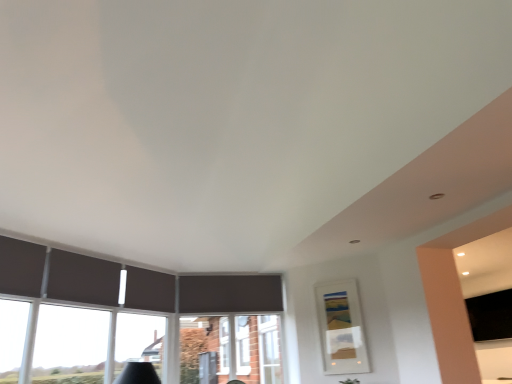
Locate an element on the screen. This screenshot has width=512, height=384. matte white picture frame at center-right is located at coordinates (341, 328).

This screenshot has width=512, height=384. What do you see at coordinates (269, 349) in the screenshot?
I see `white plastic window frame at center` at bounding box center [269, 349].

Where is `matte white picture frame at center-right`? The height and width of the screenshot is (384, 512). matte white picture frame at center-right is located at coordinates (341, 328).

From a real-world perspective, is white plastic window frame at center physically above transparent glass window at lower left?

No, from a real-world perspective, white plastic window frame at center is not above transparent glass window at lower left.

Is white plastic window frame at center wider or thinner than transparent glass window at lower left?

Considering their sizes, white plastic window frame at center looks broader than transparent glass window at lower left.

Looking at this image, considering the positions of objects white plastic window frame at center and transparent glass window at lower left in the image provided, who is more to the right, white plastic window frame at center or transparent glass window at lower left?

From the viewer's perspective, white plastic window frame at center appears more on the right side.

Does white plastic window frame at center have a smaller size compared to transparent glass window at lower left?

Actually, white plastic window frame at center might be larger than transparent glass window at lower left.

Is black matte tv at right located outside matte white picture frame at center-right?

Indeed, black matte tv at right is completely outside matte white picture frame at center-right.

Does black matte tv at right turn towards matte white picture frame at center-right?

Yes, black matte tv at right is oriented towards matte white picture frame at center-right.

Between black matte tv at right and matte white picture frame at center-right, which one appears on the right side from the viewer's perspective?

black matte tv at right.

Which is more distant, (x=480, y=325) or (x=154, y=332)?

The point (x=154, y=332) is more distant.

Does black matte tv at right contain transparent glass window at lower left?

Actually, transparent glass window at lower left is outside black matte tv at right.

From a real-world perspective, between black matte tv at right and transparent glass window at lower left, who is vertically lower?

transparent glass window at lower left.

Does black matte tv at right have a greater width compared to transparent glass window at lower left?

Indeed, black matte tv at right has a greater width compared to transparent glass window at lower left.

Between transparent glass window at lower left and matte white picture frame at center-right, which one has smaller size?

Smaller between the two is matte white picture frame at center-right.

Is transparent glass window at lower left further to camera compared to matte white picture frame at center-right?

No, transparent glass window at lower left is closer to the viewer.

How many degrees apart are the facing directions of transparent glass window at lower left and matte white picture frame at center-right?

The angular difference between transparent glass window at lower left and matte white picture frame at center-right is 91.1 degrees.

From the image's perspective, is transparent glass window at lower left above or below matte white picture frame at center-right?

transparent glass window at lower left is situated higher than matte white picture frame at center-right in the image.

Considering the sizes of white plastic window frame at center and matte white picture frame at center-right in the image, is white plastic window frame at center taller or shorter than matte white picture frame at center-right?

Clearly, white plastic window frame at center is taller compared to matte white picture frame at center-right.

Could you measure the distance between white plastic window frame at center and matte white picture frame at center-right?

white plastic window frame at center is 32.44 inches away from matte white picture frame at center-right.

Is white plastic window frame at center smaller than matte white picture frame at center-right?

No.

Considering the relative positions of white plastic window frame at center and matte white picture frame at center-right in the image provided, is white plastic window frame at center to the right of matte white picture frame at center-right from the viewer's perspective?

No, white plastic window frame at center is not to the right of matte white picture frame at center-right.

Is point (492, 333) positioned after point (265, 320)?

No, (492, 333) is closer to viewer.

How many degrees apart are the facing directions of black matte tv at right and white plastic window frame at center?

179 degrees separate the facing orientations of black matte tv at right and white plastic window frame at center.

Considering the relative sizes of black matte tv at right and white plastic window frame at center in the image provided, is black matte tv at right shorter than white plastic window frame at center?

Correct, black matte tv at right is not as tall as white plastic window frame at center.

Looking at this image, from a real-world perspective, which is physically above, black matte tv at right or white plastic window frame at center?

In real-world perspective, black matte tv at right is above.

Is matte white picture frame at center-right smaller than transparent glass window at lower left?

Correct, matte white picture frame at center-right occupies less space than transparent glass window at lower left.

Is point (354, 314) farther from viewer compared to point (126, 329)?

Yes, it is.

Considering the positions of objects matte white picture frame at center-right and transparent glass window at lower left in the image provided, who is more to the left, matte white picture frame at center-right or transparent glass window at lower left?

Positioned to the left is transparent glass window at lower left.

Can you tell me how much matte white picture frame at center-right and transparent glass window at lower left differ in facing direction?

The angle between the facing direction of matte white picture frame at center-right and the facing direction of transparent glass window at lower left is 91.1 degrees.

Locate an element on the screen. This screenshot has width=512, height=384. window frame that appears behind the transparent glass window at lower left is located at coordinates (269, 349).

The image size is (512, 384). In order to click on picture frame that is in front of the black matte tv at right in this screenshot , I will do `click(341, 328)`.

Based on their spatial positions, is white plastic window frame at center or black matte tv at right closer to transparent glass window at lower left?

white plastic window frame at center is positioned closer to the anchor transparent glass window at lower left.

Looking at the image, which one is located closer to black matte tv at right, white plastic window frame at center or matte white picture frame at center-right?

matte white picture frame at center-right lies closer to black matte tv at right than the other object.

When comparing their distances from matte white picture frame at center-right, does black matte tv at right or transparent glass window at lower left seem further?

transparent glass window at lower left.

From the image, which object appears to be nearer to white plastic window frame at center, black matte tv at right or matte white picture frame at center-right?

Based on the image, matte white picture frame at center-right appears to be nearer to white plastic window frame at center.

Based on their spatial positions, is matte white picture frame at center-right or white plastic window frame at center closer to black matte tv at right?

matte white picture frame at center-right lies closer to black matte tv at right than the other object.

Estimate the real-world distances between objects in this image. Which object is further from white plastic window frame at center, transparent glass window at lower left or matte white picture frame at center-right?

transparent glass window at lower left lies further to white plastic window frame at center than the other object.

Considering their positions, is black matte tv at right positioned closer to transparent glass window at lower left than matte white picture frame at center-right?

matte white picture frame at center-right lies closer to transparent glass window at lower left than the other object.

Estimate the real-world distances between objects in this image. Which object is further from matte white picture frame at center-right, white plastic window frame at center or transparent glass window at lower left?

transparent glass window at lower left is positioned further to the anchor matte white picture frame at center-right.

I want to click on window frame between transparent glass window at lower left and matte white picture frame at center-right, so click(269, 349).

Locate an element on the screen. The width and height of the screenshot is (512, 384). picture frame between transparent glass window at lower left and black matte tv at right from left to right is located at coordinates (341, 328).

The height and width of the screenshot is (384, 512). I want to click on picture frame between white plastic window frame at center and black matte tv at right from left to right, so click(x=341, y=328).

The width and height of the screenshot is (512, 384). In order to click on window frame located between transparent glass window at lower left and black matte tv at right in the left-right direction in this screenshot , I will do `click(269, 349)`.